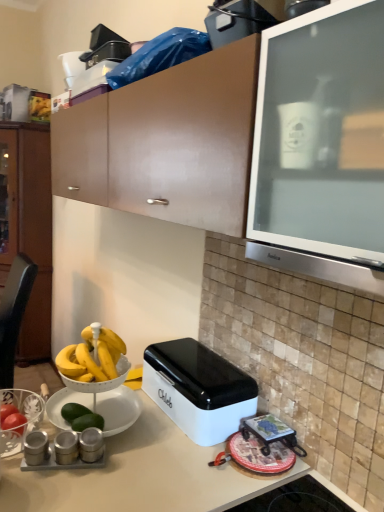
Question: From a real-world perspective, does metallic silver canisters at lower left, which is the 1th appliance in front-to-back order, stand above matte black toaster at upper center, the 2th appliance viewed from the back?

Choices:
 (A) no
 (B) yes

Answer: (A)

Question: Does metallic silver canisters at lower left, which appears as the 4th appliance when ordered from the bottom, have a lesser width compared to matte black toaster at upper center, positioned as the 5th appliance in bottom-to-top order?

Choices:
 (A) yes
 (B) no

Answer: (A)

Question: Considering the relative positions of metallic silver canisters at lower left, the 6th appliance positioned from the back, and matte black toaster at upper center, which appears as the second appliance when viewed from the top, in the image provided, is metallic silver canisters at lower left, the 6th appliance positioned from the back, to the right of matte black toaster at upper center, which appears as the second appliance when viewed from the top, from the viewer's perspective?

Choices:
 (A) yes
 (B) no

Answer: (B)

Question: Is metallic silver canisters at lower left, which is the 1th appliance in front-to-back order, at the left side of matte black toaster at upper center, which appears as the second appliance when viewed from the top?

Choices:
 (A) no
 (B) yes

Answer: (B)

Question: Is metallic silver canisters at lower left, positioned as the 3th appliance in top-to-bottom order, wider than matte black toaster at upper center, the 2th appliance viewed from the back?

Choices:
 (A) no
 (B) yes

Answer: (A)

Question: In terms of height, does silver metallic salt and pepper shakers at lower left, the third appliance ordered from the bottom, look taller or shorter compared to black leather chair at left?

Choices:
 (A) tall
 (B) short

Answer: (B)

Question: Is silver metallic salt and pepper shakers at lower left, the 3th appliance in the front-to-back sequence, inside the boundaries of black leather chair at left, or outside?

Choices:
 (A) inside
 (B) outside

Answer: (B)

Question: From the image's perspective, is silver metallic salt and pepper shakers at lower left, the 3th appliance in the front-to-back sequence, above or below black leather chair at left?

Choices:
 (A) above
 (B) below

Answer: (A)

Question: Is silver metallic salt and pepper shakers at lower left, the third appliance ordered from the bottom, bigger or smaller than black leather chair at left?

Choices:
 (A) small
 (B) big

Answer: (A)

Question: Is white plastic appliance at upper center, marked as the sixth appliance in a front-to-back arrangement, inside the boundaries of black leather chair at left, or outside?

Choices:
 (A) outside
 (B) inside

Answer: (A)

Question: Is white plastic appliance at upper center, which is counted as the first appliance, starting from the top, to the left or to the right of black leather chair at left in the image?

Choices:
 (A) left
 (B) right

Answer: (B)

Question: In terms of width, does white plastic appliance at upper center, the sixth appliance in the bottom-to-top sequence, look wider or thinner when compared to black leather chair at left?

Choices:
 (A) wide
 (B) thin

Answer: (B)

Question: From the image's perspective, is white plastic appliance at upper center, which is counted as the first appliance, starting from the top, positioned above or below black leather chair at left?

Choices:
 (A) above
 (B) below

Answer: (A)

Question: From the image's perspective, is brown matte cabinet at left positioned above or below silver metallic spice containers at lower left, the 3th appliance from the back?

Choices:
 (A) above
 (B) below

Answer: (A)

Question: Looking at the image, does brown matte cabinet at left seem bigger or smaller compared to silver metallic spice containers at lower left, the 3th appliance from the back?

Choices:
 (A) small
 (B) big

Answer: (B)